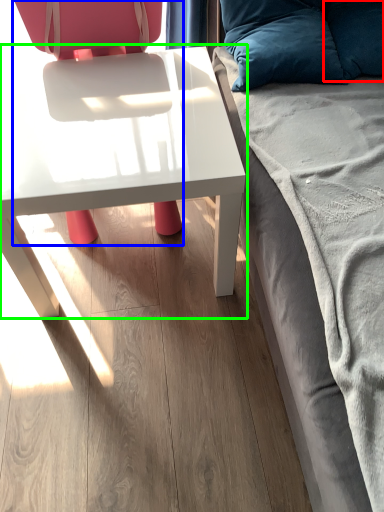
Question: Based on their relative distances, which object is farther from pillow (highlighted by a red box)? Choose from chair (highlighted by a blue box) and table (highlighted by a green box).

Choices:
 (A) chair
 (B) table

Answer: (A)